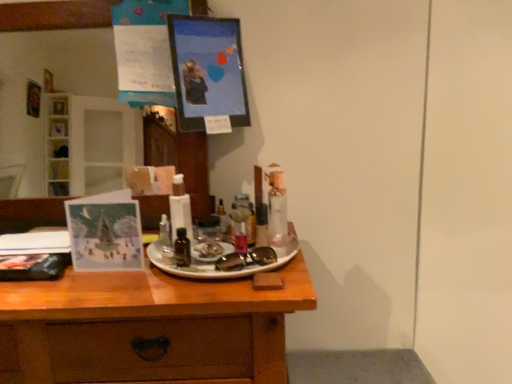
How much space does translucent plastic tube at center, the first toiletry in the back-to-front sequence, occupy horizontally?

The width of translucent plastic tube at center, the first toiletry in the back-to-front sequence, is 1.59 inches.

The height and width of the screenshot is (384, 512). I want to click on black glass bottle at center, positioned as the third toiletry in back-to-front order, so (x=182, y=248).

The image size is (512, 384). In order to click on metallic picture frame at upper center in this screenshot , I will do `click(207, 70)`.

Find the location of `translucent plastic tube at center, acting as the second toiletry starting from the right`. translucent plastic tube at center, acting as the second toiletry starting from the right is located at coordinates (250, 215).

Considering the sizes of translucent plastic tube at center, the third toiletry positioned from the front, and wooden desk at center in the image, is translucent plastic tube at center, the third toiletry positioned from the front, taller or shorter than wooden desk at center?

translucent plastic tube at center, the third toiletry positioned from the front, is shorter than wooden desk at center.

Is translucent plastic tube at center, the 2th toiletry when ordered from left to right, next to wooden desk at center and touching it?

No, translucent plastic tube at center, the 2th toiletry when ordered from left to right, is not touching wooden desk at center.

Based on the photo, can you tell me how much translucent plastic tube at center, the first toiletry in the back-to-front sequence, and wooden desk at center differ in facing direction?

1.36 degrees separate the facing orientations of translucent plastic tube at center, the first toiletry in the back-to-front sequence, and wooden desk at center.

Between translucent plastic tube at center, the third toiletry positioned from the front, and wooden desk at center, which one has larger width?

Wider between the two is wooden desk at center.

Between point (228, 22) and point (184, 245), which one is positioned in front?

The point (184, 245) is more forward.

Are metallic picture frame at upper center and black glass bottle at center, which is counted as the first toiletry, starting from the front, beside each other?

metallic picture frame at upper center and black glass bottle at center, which is counted as the first toiletry, starting from the front, are clearly separated.

Can you confirm if metallic picture frame at upper center is shorter than black glass bottle at center, which is counted as the first toiletry, starting from the front?

In fact, metallic picture frame at upper center may be taller than black glass bottle at center, which is counted as the first toiletry, starting from the front.

What's the angular difference between metallic picture frame at upper center and black glass bottle at center, the 3th toiletry from the right,'s facing directions?

They differ by 3.97 degrees in their facing directions.

Is translucent plastic tube at center, acting as the second toiletry starting from the right, facing towards metallic picture frame at upper center?

No.

Is translucent plastic tube at center, acting as the second toiletry starting from the right, taller or shorter than metallic picture frame at upper center?

Clearly, translucent plastic tube at center, acting as the second toiletry starting from the right, is shorter compared to metallic picture frame at upper center.

Considering the positions of objects translucent plastic tube at center, the third toiletry positioned from the front, and metallic picture frame at upper center in the image provided, who is more to the right, translucent plastic tube at center, the third toiletry positioned from the front, or metallic picture frame at upper center?

Positioned to the right is translucent plastic tube at center, the third toiletry positioned from the front.

Which is farther, [241,194] or [175,64]?

The point [241,194] is more distant.

Can you confirm if metallic picture frame at upper center is positioned to the right of metallic silver spray can at center, which is the 1th toiletry from right to left?

No.

Could you tell me if metallic picture frame at upper center is turned towards metallic silver spray can at center, which ranks as the 2th toiletry in front-to-back order?

No, metallic picture frame at upper center is not oriented towards metallic silver spray can at center, which ranks as the 2th toiletry in front-to-back order.

Is metallic picture frame at upper center smaller than metallic silver spray can at center, which is the third toiletry from left to right?

No, metallic picture frame at upper center is not smaller than metallic silver spray can at center, which is the third toiletry from left to right.

Are metallic picture frame at upper center and metallic silver spray can at center, which is the 1th toiletry from right to left, located far from each other?

No, metallic picture frame at upper center is in close proximity to metallic silver spray can at center, which is the 1th toiletry from right to left.

Does translucent plastic tube at center, acting as the second toiletry starting from the right, turn towards metallic silver spray can at center, which is the 1th toiletry from right to left?

No, translucent plastic tube at center, acting as the second toiletry starting from the right, is not turned towards metallic silver spray can at center, which is the 1th toiletry from right to left.

Between translucent plastic tube at center, the third toiletry positioned from the front, and metallic silver spray can at center, which is the 1th toiletry from right to left, which one has smaller size?

With smaller size is metallic silver spray can at center, which is the 1th toiletry from right to left.

From the image's perspective, which one is positioned higher, translucent plastic tube at center, the 2th toiletry when ordered from left to right, or metallic silver spray can at center, which is the 1th toiletry from right to left?

metallic silver spray can at center, which is the 1th toiletry from right to left.

Is the surface of translucent plastic tube at center, the 2th toiletry when ordered from left to right, in direct contact with metallic silver spray can at center, which is the 1th toiletry from right to left?

Yes.

From the image's perspective, which is above, metallic picture frame at upper center or wooden desk at center?

metallic picture frame at upper center.

Is metallic picture frame at upper center positioned far away from wooden desk at center?

No, metallic picture frame at upper center is not far from wooden desk at center.

From a real-world perspective, which is physically above, metallic picture frame at upper center or wooden desk at center?

metallic picture frame at upper center is physically above.

Is metallic picture frame at upper center completely or partially inside metallic silver spray can at center, which is the 1th toiletry from right to left?

No, metallic picture frame at upper center is not a part of metallic silver spray can at center, which is the 1th toiletry from right to left.

Is point (256, 214) closer or farther from the camera than point (222, 100)?

Point (256, 214) is closer to the camera than point (222, 100).

How many degrees apart are the facing directions of metallic silver spray can at center, which is the 1th toiletry from right to left, and metallic picture frame at upper center?

There is a 1.98-degree angle between the facing directions of metallic silver spray can at center, which is the 1th toiletry from right to left, and metallic picture frame at upper center.

Between metallic silver spray can at center, which is the 1th toiletry from right to left, and metallic picture frame at upper center, which one has less height?

metallic silver spray can at center, which is the 1th toiletry from right to left.

Identify the location of desk in front of the translucent plastic tube at center, the first toiletry in the back-to-front sequence. Image resolution: width=512 pixels, height=384 pixels. (148, 327).

You are a GUI agent. You are given a task and a screenshot of the screen. Output one action in this format:
    pyautogui.click(x=<x>, y=<y>)
    Task: Click on the 3rd toiletry positioned below the metallic picture frame at upper center (from the image's perspective)
    
    Given the screenshot: What is the action you would take?
    pyautogui.click(x=182, y=248)

Which object lies further to the anchor point metallic picture frame at upper center, metallic silver spray can at center, which ranks as the 2th toiletry in front-to-back order, or translucent plastic tube at center, the third toiletry positioned from the front?

Among the two, metallic silver spray can at center, which ranks as the 2th toiletry in front-to-back order, is located further to metallic picture frame at upper center.

Which object lies nearer to the anchor point black glass bottle at center, which is counted as the first toiletry, starting from the front, metallic picture frame at upper center or metallic silver spray can at center, which is the 1th toiletry from right to left?

The object closer to black glass bottle at center, which is counted as the first toiletry, starting from the front, is metallic silver spray can at center, which is the 1th toiletry from right to left.

Based on their spatial positions, is wooden desk at center or translucent plastic tube at center, the first toiletry in the back-to-front sequence, closer to black glass bottle at center, the first toiletry positioned from the left?

Based on the image, translucent plastic tube at center, the first toiletry in the back-to-front sequence, appears to be nearer to black glass bottle at center, the first toiletry positioned from the left.

From the image, which object appears to be nearer to metallic picture frame at upper center, translucent plastic tube at center, acting as the second toiletry starting from the right, or metallic silver spray can at center, which ranks as the 2th toiletry in front-to-back order?

translucent plastic tube at center, acting as the second toiletry starting from the right, is positioned closer to the anchor metallic picture frame at upper center.

Looking at this image, based on their spatial positions, is wooden desk at center or black glass bottle at center, the first toiletry positioned from the left, further from metallic silver spray can at center, which is the 1th toiletry from right to left?

Among the two, wooden desk at center is located further to metallic silver spray can at center, which is the 1th toiletry from right to left.

Based on their spatial positions, is wooden desk at center or metallic silver spray can at center, which is the third toiletry from left to right, closer to black glass bottle at center, the 3th toiletry from the right?

metallic silver spray can at center, which is the third toiletry from left to right, is closer to black glass bottle at center, the 3th toiletry from the right.

When comparing their distances from black glass bottle at center, the 3th toiletry from the right, does metallic silver spray can at center, which is the 1th toiletry from right to left, or translucent plastic tube at center, the first toiletry in the back-to-front sequence, seem closer?

Among the two, metallic silver spray can at center, which is the 1th toiletry from right to left, is located nearer to black glass bottle at center, the 3th toiletry from the right.

Estimate the real-world distances between objects in this image. Which object is further from black glass bottle at center, positioned as the third toiletry in back-to-front order, metallic picture frame at upper center or wooden desk at center?

metallic picture frame at upper center.

Locate an element on the screen. toiletry between translucent plastic tube at center, the first toiletry in the back-to-front sequence, and wooden desk at center vertically is located at coordinates (182, 248).

I want to click on toiletry between metallic picture frame at upper center and translucent plastic tube at center, the third toiletry positioned from the front, vertically, so click(261, 224).

Find the location of a particular element. The height and width of the screenshot is (384, 512). toiletry located between black glass bottle at center, positioned as the third toiletry in back-to-front order, and metallic silver spray can at center, which ranks as the 2th toiletry in front-to-back order, in the left-right direction is located at coordinates coord(250,215).